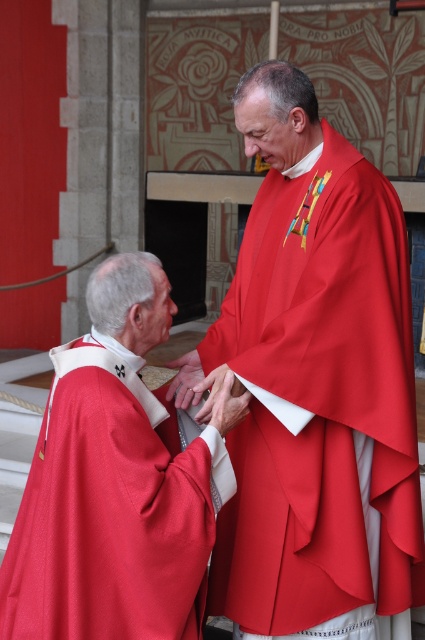
You are an observer standing in front of the image. You need to determine the position of the matte red robe at center relative to the stone wall in the background. Is it closer to the front or the back of the scene?

The matte red robe at center is located at point (314,385), which places it closer to the front of the scene since lower y coordinates typically indicate positions lower down in the image, but without more context on the coordinate system, it is safest to state the coordinates as given.

You are standing in front of the scene and want to know which of the two points, point (268, 307) or point (93, 513), is closer to you. Can you determine this based on their positions?

Point (93, 513) is closer to you because it is positioned closer to the camera than point (268, 307).

Based on the photo, you are a costume designer preparing for a religious ceremony. You need to ensure that the matte red robe at center and the matte red cape at lower left can be worn by two actors. Given that the actors have similar body sizes, which costume requires more space when worn?

The matte red robe at center requires more space when worn because its width is larger than the matte red cape at lower left.